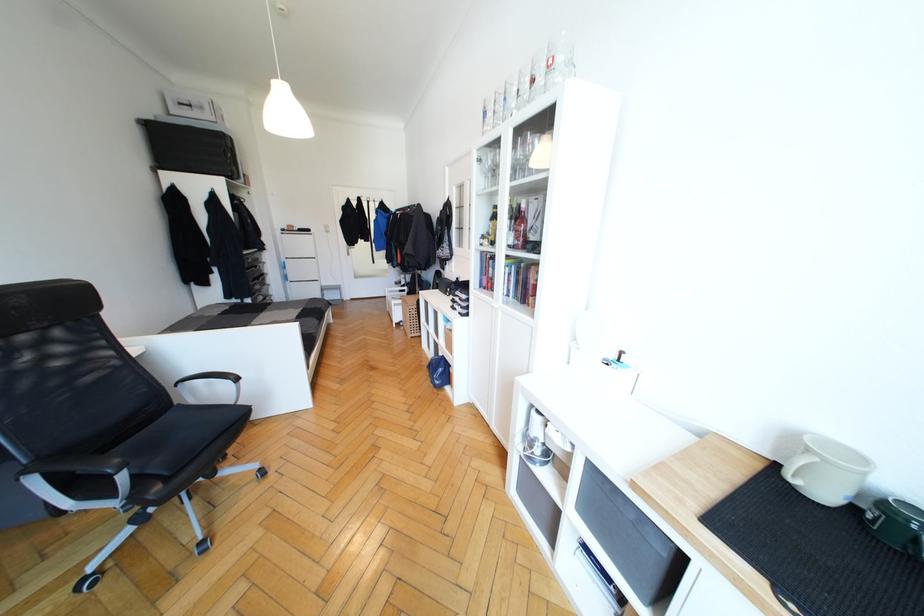
The location [519,227] corresponds to which object?

This point indicates the pink liquor bottle.